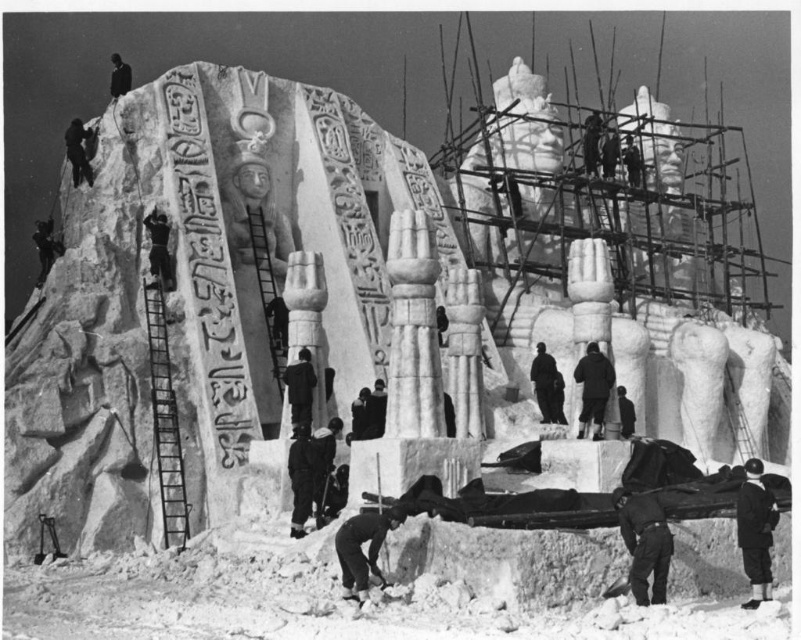
Question: Which point appears closest to the camera in this image?

Choices:
 (A) (650, 499)
 (B) (580, 376)
 (C) (759, 593)

Answer: (C)

Question: Based on their relative distances, which object is farther from the black fabric at upper left?

Choices:
 (A) dark gray uniform at lower right
 (B) dark wool coat at center
 (C) black fabric at lower right

Answer: (A)

Question: Estimate the real-world distances between objects in this image. Which object is closer to the black fabric at lower right?

Choices:
 (A) dark gray uniform at lower right
 (B) black matte person at upper left
 (C) dark wool coat at center
 (D) black matte person at center

Answer: (A)

Question: Can you confirm if dark wool coat at center is positioned to the left of black matte person at center?

Choices:
 (A) yes
 (B) no

Answer: (B)

Question: Considering the relative positions of dark gray stone figure at center and black fabric at upper left in the image provided, where is dark gray stone figure at center located with respect to black fabric at upper left?

Choices:
 (A) above
 (B) below

Answer: (B)

Question: Is dark gray uniform at lower right positioned behind dark gray stone figure at center?

Choices:
 (A) yes
 (B) no

Answer: (A)